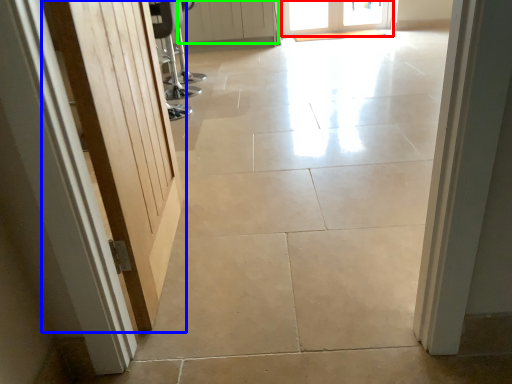
Question: Considering the real-world distances, which object is farthest from door (highlighted by a red box)? door (highlighted by a blue box) or door (highlighted by a green box)?

Choices:
 (A) door
 (B) door

Answer: (A)